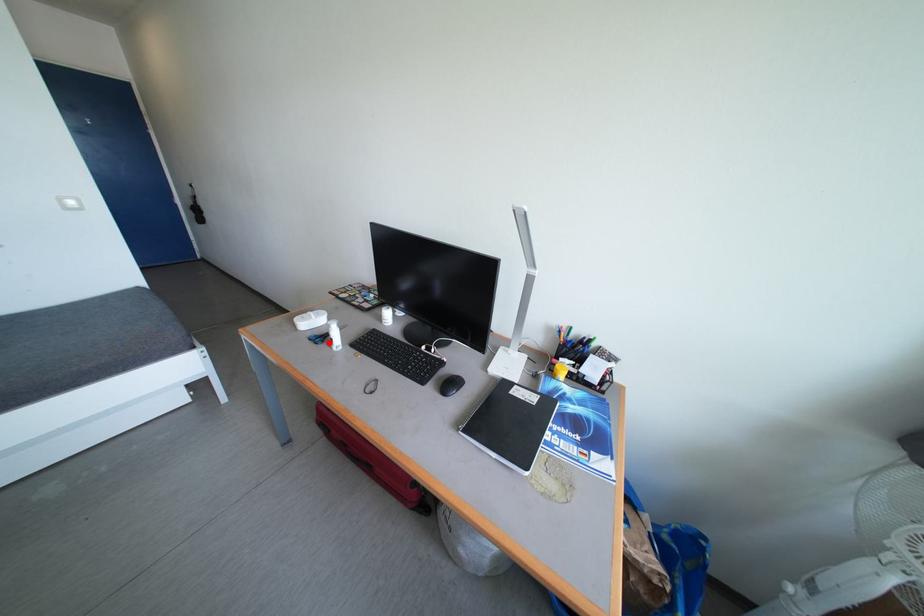
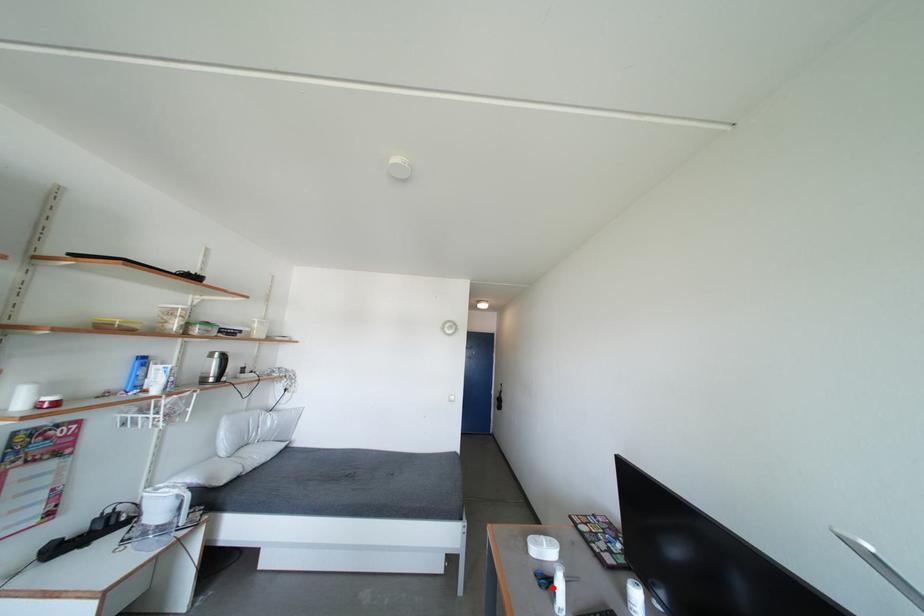
I am providing you with two images of the same scene from different viewpoints. A red point is marked on the first image and another point is marked on the second image. Does the point marked in image1 correspond to the same location as the one in image2?

Yes